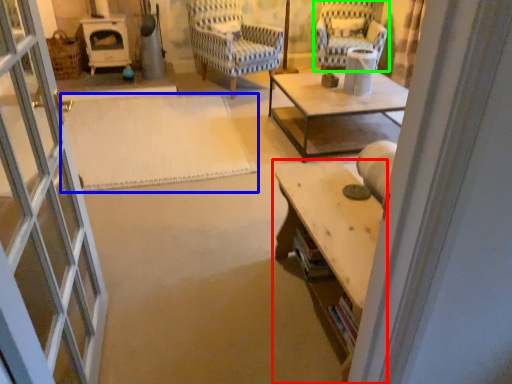
Question: Considering the real-world distances, which object is farthest from table (highlighted by a red box)? mat (highlighted by a blue box) or chair (highlighted by a green box)?

Choices:
 (A) mat
 (B) chair

Answer: (B)